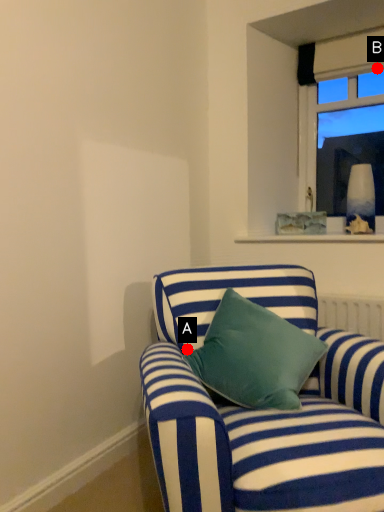
Question: Two points are circled on the image, labeled by A and B beside each circle. Which point is closer to the camera?

Choices:
 (A) A is closer
 (B) B is closer

Answer: (A)